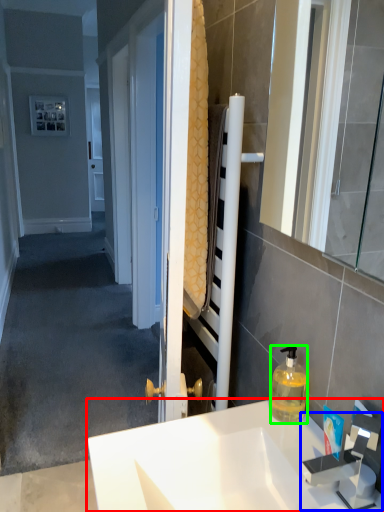
Question: Which is nearer to the sink (highlighted by a red box)? faucet (highlighted by a blue box) or bottle (highlighted by a green box).

Choices:
 (A) faucet
 (B) bottle

Answer: (A)